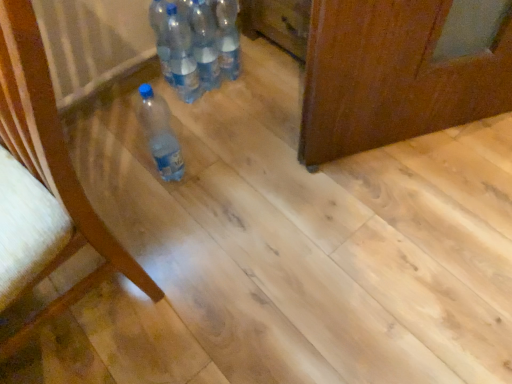
Where is `free space in front of translucent plastic bottle at center, the fourth bottle when ordered from bottom to top`? This screenshot has width=512, height=384. free space in front of translucent plastic bottle at center, the fourth bottle when ordered from bottom to top is located at coordinates (244, 109).